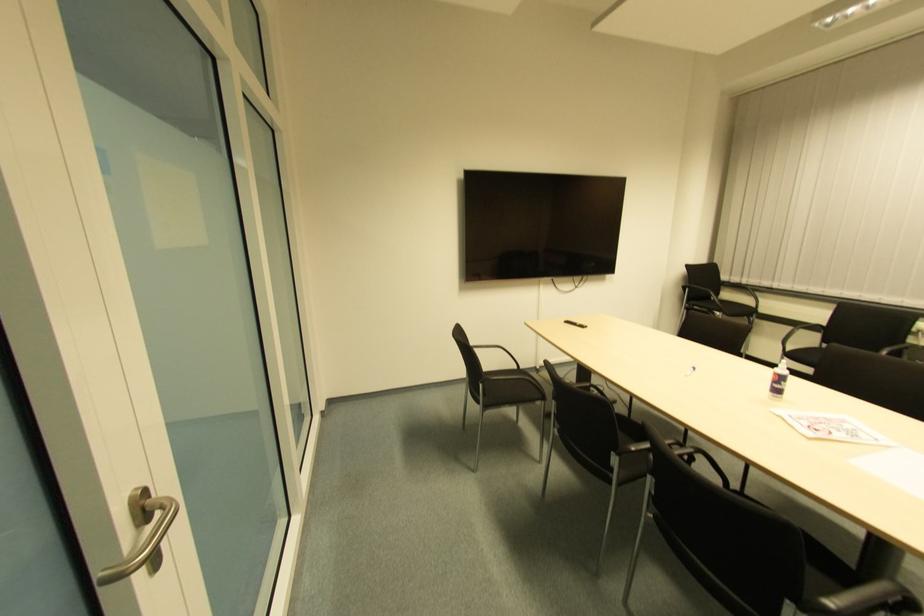
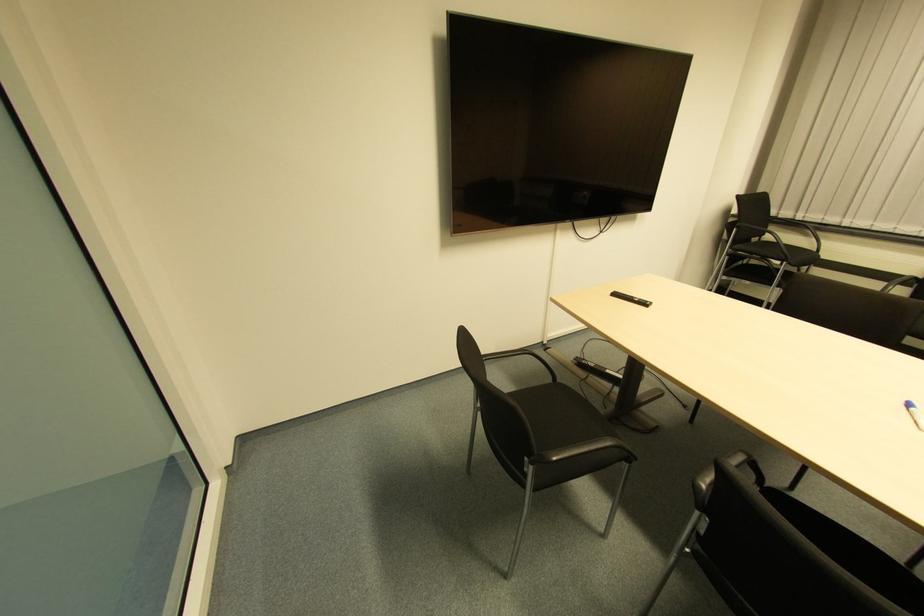
Find the pixel in the second image that matches point 691,371 in the first image.

(907, 408)